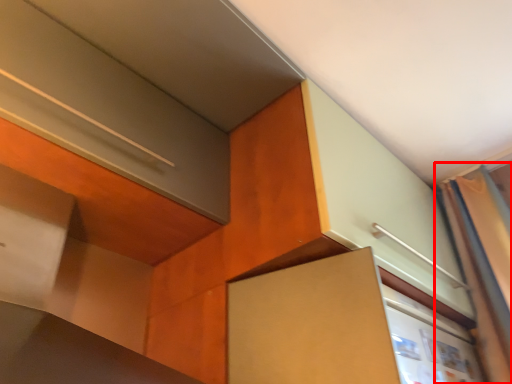
Question: Considering the relative positions of curtain (annotated by the red box) and cabinetry in the image provided, where is curtain (annotated by the red box) located with respect to the staircase?

Choices:
 (A) left
 (B) right

Answer: (B)